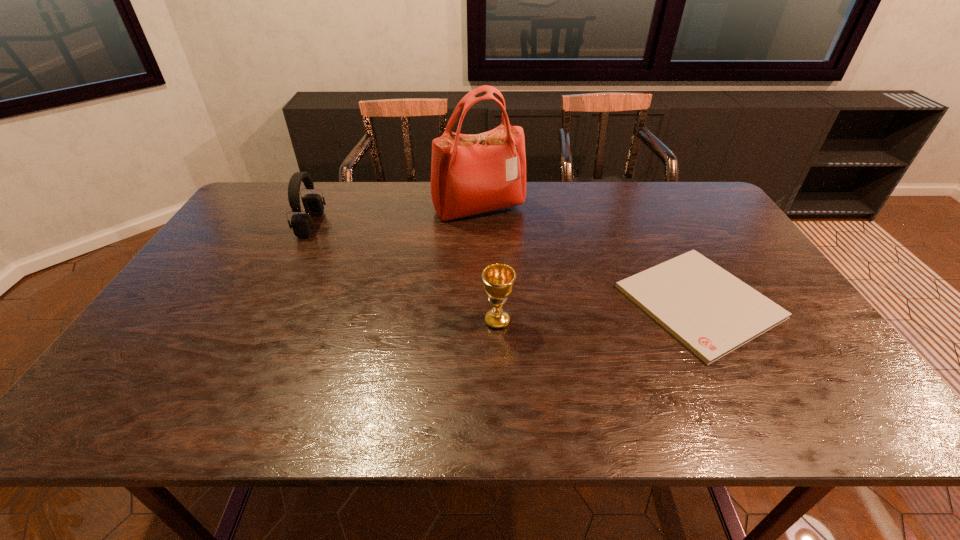
Locate an element on the screen. Image resolution: width=960 pixels, height=540 pixels. the tallest object is located at coordinates (470, 174).

Where is `headset`? headset is located at coordinates (302, 225).

Where is `chalice`? This screenshot has width=960, height=540. chalice is located at coordinates (498, 279).

Where is `the rightmost object`? the rightmost object is located at coordinates (712, 312).

The image size is (960, 540). In order to click on clipboard in this screenshot , I will do `click(712, 312)`.

At what (x,y) coordinates should I click in order to perform the action: click on vacant area situated 0.380m on the front-facing side of the tallest object. Please return your answer as a coordinate pair (x, y). This screenshot has width=960, height=540. Looking at the image, I should click on [478, 313].

Locate an element on the screen. The height and width of the screenshot is (540, 960). blank area located 0.180m on the headband of the headset is located at coordinates (378, 225).

Identify the location of free space located 0.060m on the right of the chalice. (537, 321).

This screenshot has height=540, width=960. I want to click on vacant point located on the back of the rightmost object, so click(644, 199).

You are a GUI agent. You are given a task and a screenshot of the screen. Output one action in this format:
    pyautogui.click(x=<x>, y=<y>)
    Task: Click on the handbag present at the far edge
    This screenshot has width=960, height=540.
    Given the screenshot: What is the action you would take?
    pyautogui.click(x=470, y=174)